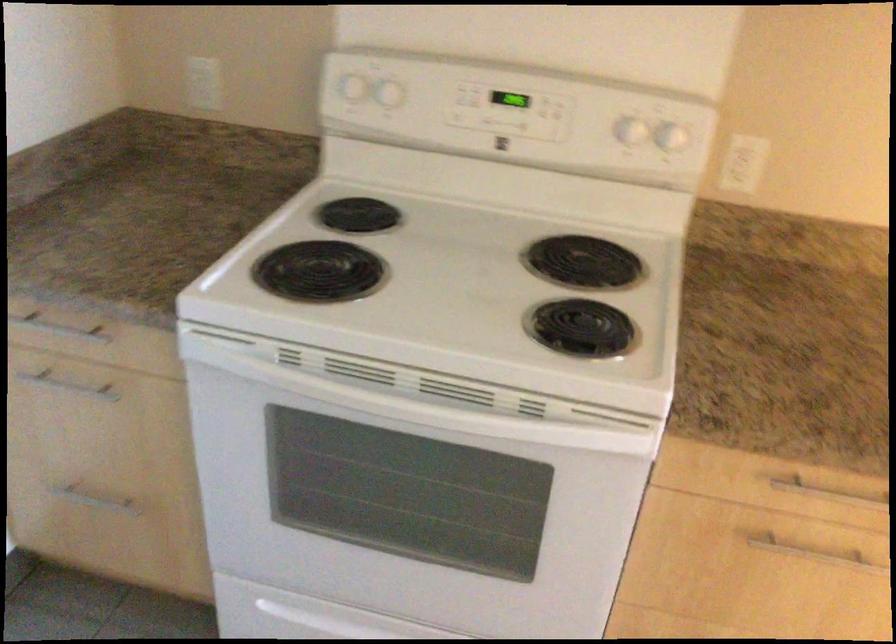
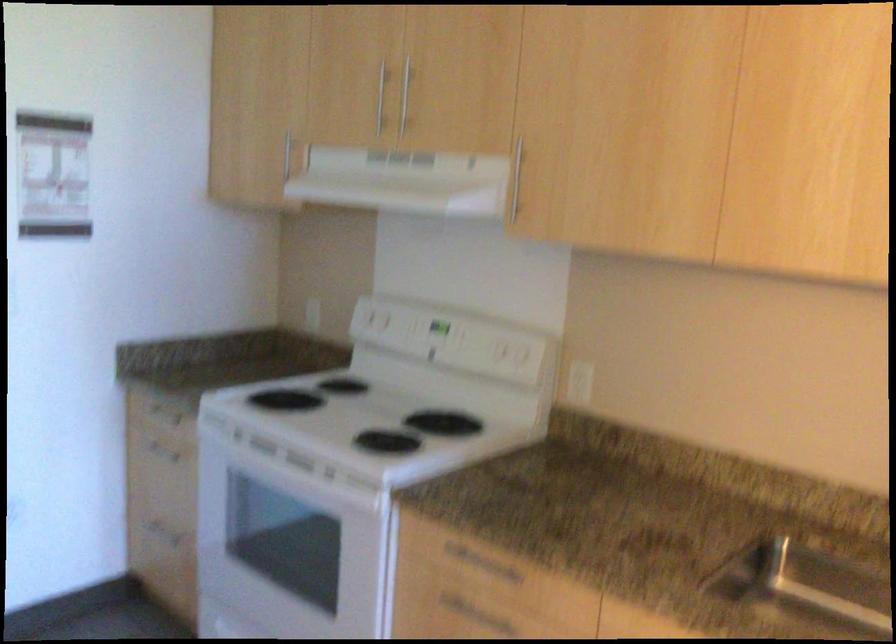
Locate, in the second image, the point that corresponds to [803,482] in the first image.

(480, 564)